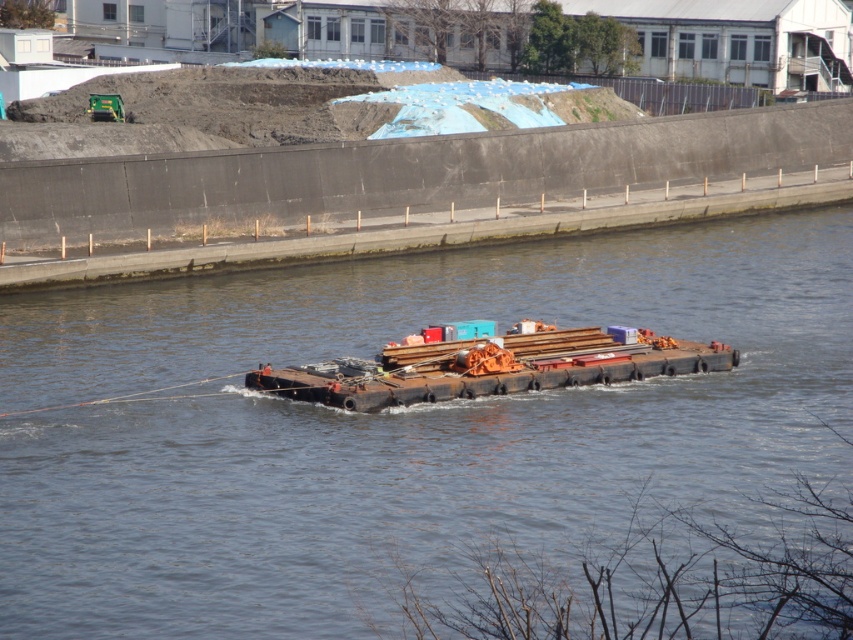
Who is more forward, [201,333] or [247,376]?

Point [247,376] is more forward.

Between point (741, 289) and point (271, 374), which one is positioned behind?

Positioned behind is point (741, 289).

Locate an element on the screen. brown rubber barge at center is located at coordinates [x=393, y=426].